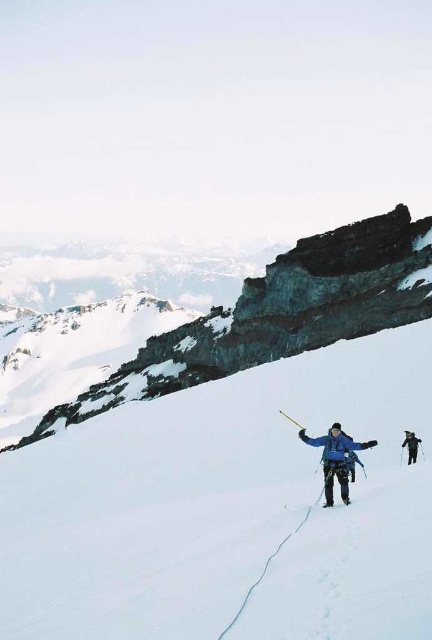
Question: In this image, where is white snow ski slope at center located relative to dark blue jacket at center?

Choices:
 (A) right
 (B) left

Answer: (B)

Question: Which point is farther to the camera?

Choices:
 (A) (323, 502)
 (B) (336, 426)

Answer: (B)

Question: Which object appears closest to the camera in this image?

Choices:
 (A) white snow ski slope at center
 (B) smooth gray rock at center

Answer: (A)

Question: Estimate the real-world distances between objects in this image. Which object is farther from the smooth gray rock at center?

Choices:
 (A) dark blue jacket at center
 (B) shiny metallic ski at center
 (C) white snow ski slope at center
 (D) blue fabric jacket at center

Answer: (B)

Question: In this image, where is dark blue jacket at center located relative to shiny metallic ski at center?

Choices:
 (A) right
 (B) left

Answer: (A)

Question: Is smooth gray rock at center above shiny metallic ski at center?

Choices:
 (A) yes
 (B) no

Answer: (A)